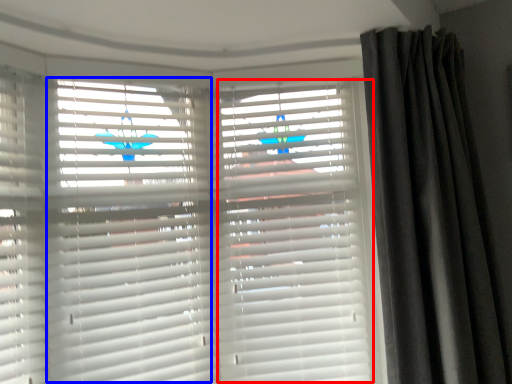
Question: Which object is closer to the camera taking this photo, shutter (highlighted by a red box) or shutter (highlighted by a blue box)?

Choices:
 (A) shutter
 (B) shutter

Answer: (B)